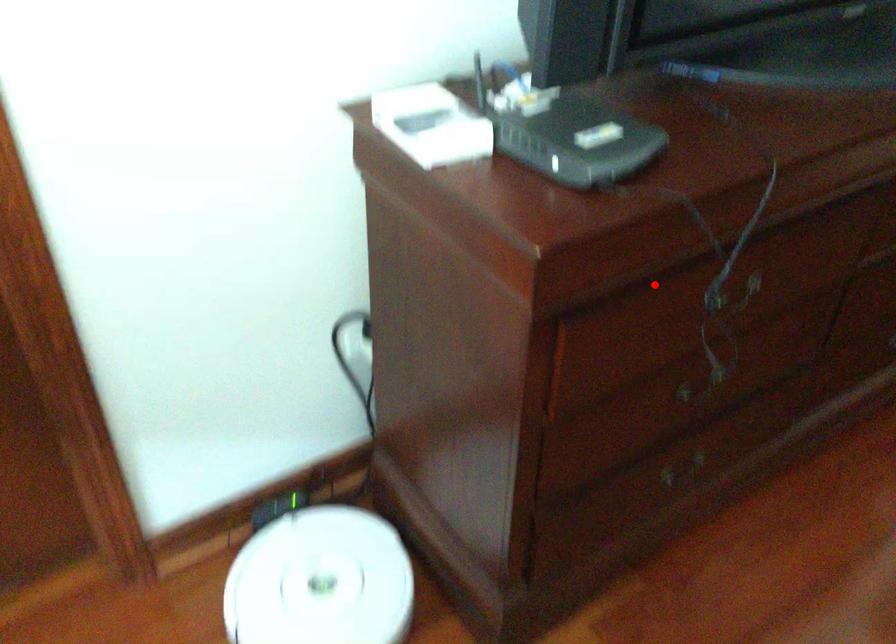
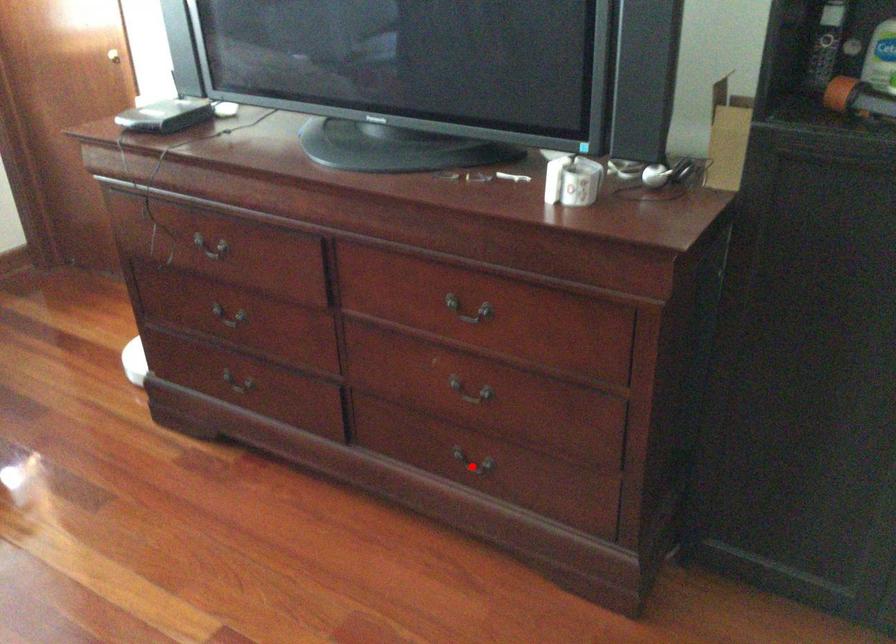
I am providing you with two images of the same scene from different viewpoints. A red point is marked on the first image and another point is marked on the second image. Are the points marked in image1 and image2 representing the same 3D position?

No